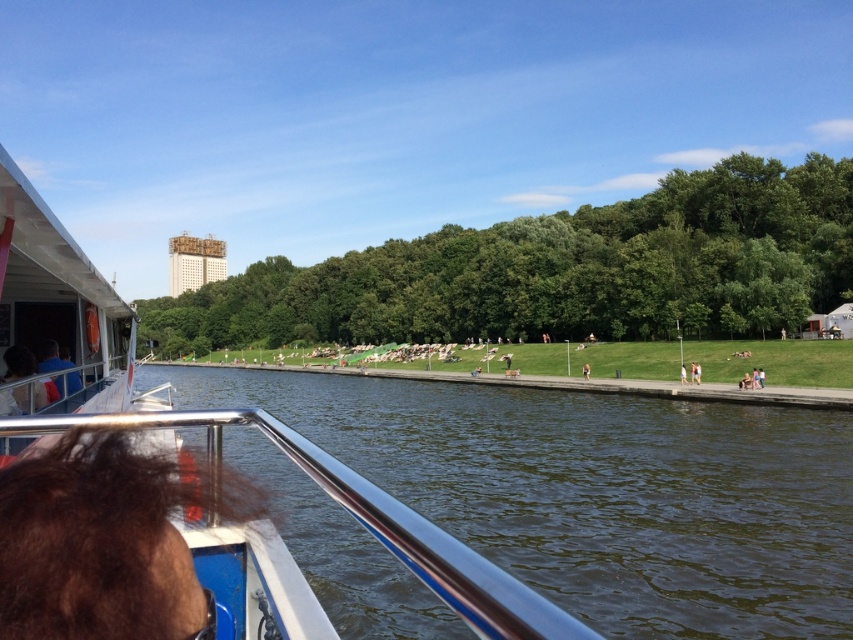
You are on a boat and see a blue fabric shirt at left and a brown fabric person at center. Which one is closer to the left edge of the boat deck?

The blue fabric shirt at left is closer to the left edge of the boat deck since it is positioned on the left side of the brown fabric person at center.

You are on a boat and want to know if the dark green water at center takes up more space than the matte black hair at lower left. Based on the scene, can you confirm this?

The dark green water at center is bigger than matte black hair at lower left, so yes, the dark green water at center takes up more space than the matte black hair at lower left.

You are on a boat and see the matte black hair at lower left and the blue fabric shirt at left. Which object is covering the other?

The matte black hair at lower left is positioned over the blue fabric shirt at left, so it is covering it.